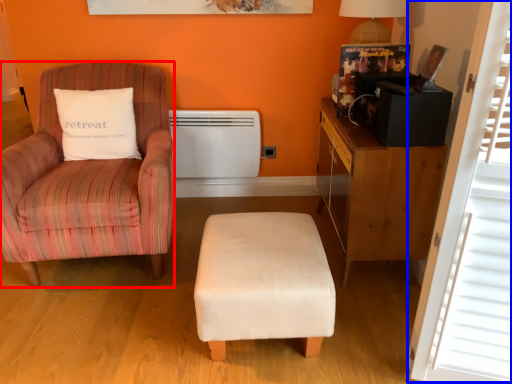
Question: Which object appears farthest to the camera in this image, chair (highlighted by a red box) or window screen (highlighted by a blue box)?

Choices:
 (A) chair
 (B) window screen

Answer: (A)